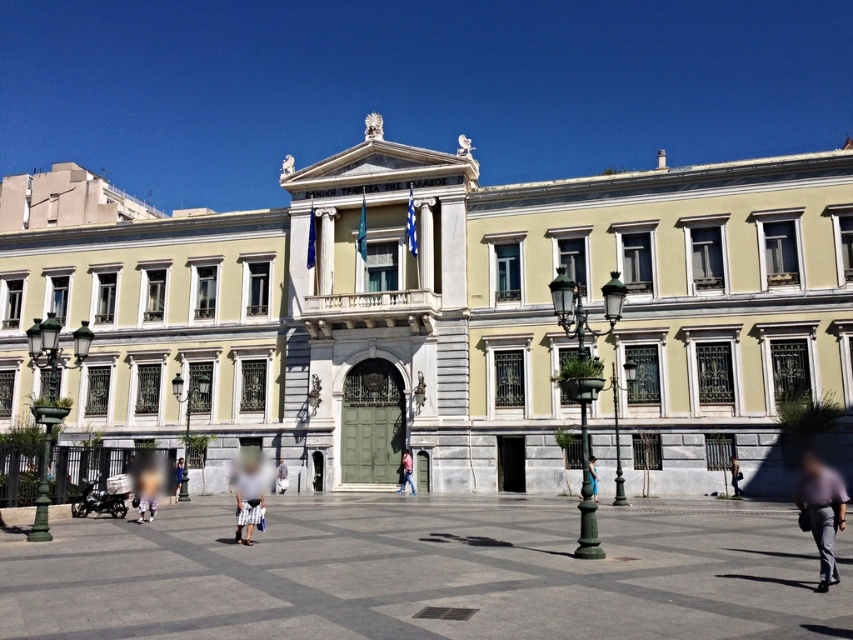
Does denim skirt at center have a lesser height compared to blue denim jeans at center?

Indeed, denim skirt at center has a lesser height compared to blue denim jeans at center.

Which is in front, point (178, 472) or point (593, 497)?

Point (593, 497) is in front.

You are a GUI agent. You are given a task and a screenshot of the screen. Output one action in this format:
    pyautogui.click(x=<x>, y=<y>)
    Task: Click on the denim skirt at center
    
    Given the screenshot: What is the action you would take?
    pyautogui.click(x=178, y=476)

Which of these two, purple fabric shirt at lower right or white striped shorts at center, stands shorter?

white striped shorts at center is shorter.

Is purple fabric shirt at lower right wider than white striped shorts at center?

Correct, the width of purple fabric shirt at lower right exceeds that of white striped shorts at center.

Does point (831, 500) come farther from viewer compared to point (258, 464)?

No, it is in front of (258, 464).

Image resolution: width=853 pixels, height=640 pixels. I want to click on purple fabric shirt at lower right, so click(x=821, y=509).

What do you see at coordinates (445, 316) in the screenshot? This screenshot has height=640, width=853. I see `light yellow stone building at center` at bounding box center [445, 316].

Who is more forward, (495,333) or (279,464)?

Point (495,333) is more forward.

Find the location of a particular element. light yellow stone building at center is located at coordinates (445, 316).